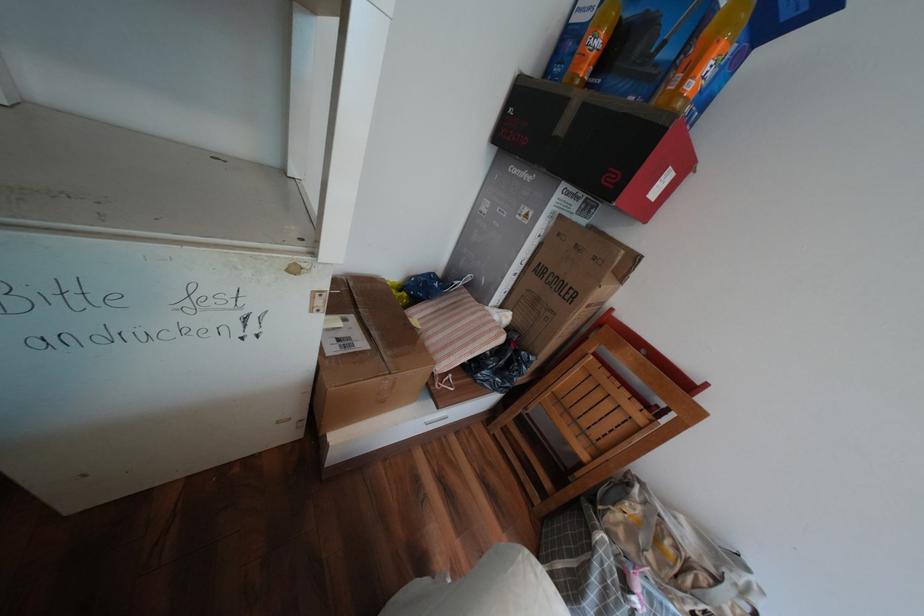
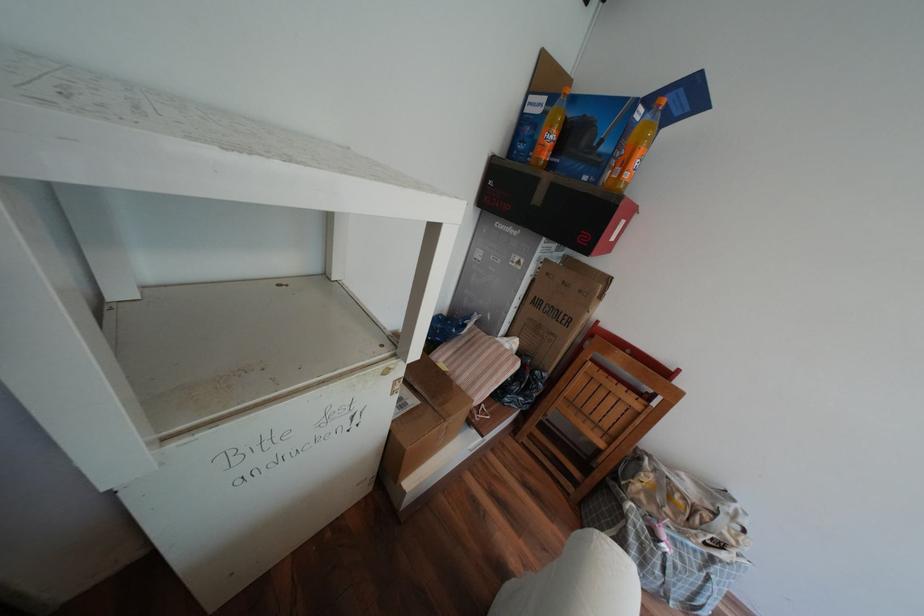
The point at (682, 65) is marked in the first image. Where is the corresponding point in the second image?

(621, 156)